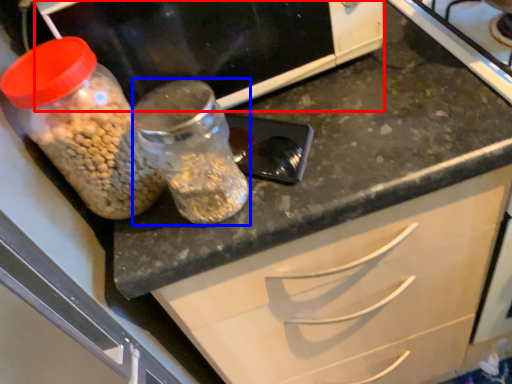
Question: Which object is further to the camera taking this photo, wide (highlighted by a red box) or glass jar (highlighted by a blue box)?

Choices:
 (A) wide
 (B) glass jar

Answer: (A)